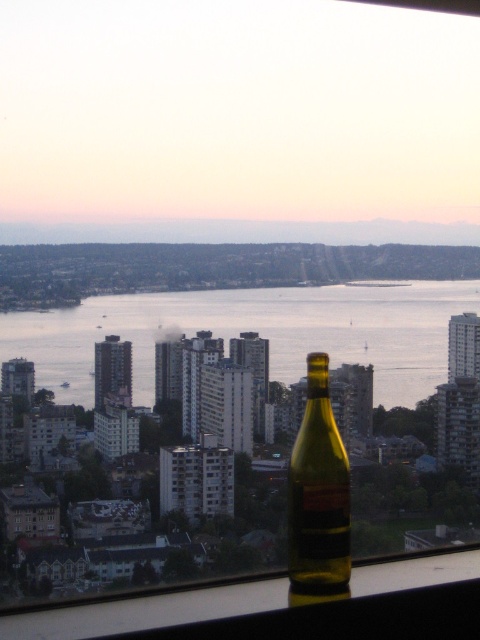
You are an architect designing a new building and want to place a transparent glass window sill at lower center in the same position as the one in the image. What are the coordinates for its placement?

The coordinates for the transparent glass window sill at lower center are at point [283,605].

You are a delivery drone that needs to place a package on the transparent glass window sill at lower center. However, there is already a matte glass bottle at center in the way. Can you place the package on the window sill without moving the bottle?

The transparent glass window sill at lower center is located below the matte glass bottle at center, so the bottle is above the window sill. Therefore, you can safely place the package on the window sill without moving the bottle since the bottle is not obstructing the sill itself.

You are an interior designer arranging a windowsill display. You have a transparent glass water at center and a matte glass bottle at center. Which object should you place first to ensure proper visibility of both items?

You should place the matte glass bottle at center first since the transparent glass water at center is larger and needs more space to be visible properly.